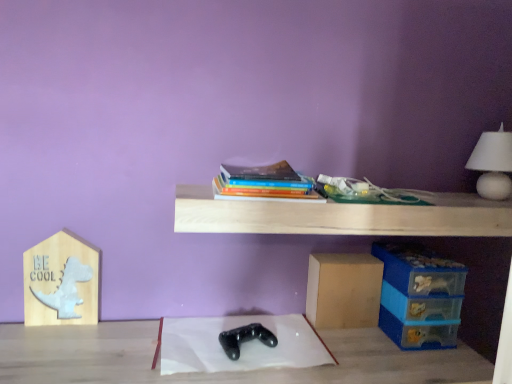
Where is `empty space that is ontop of white paper at center (from a real-world perspective)`? empty space that is ontop of white paper at center (from a real-world perspective) is located at coordinates (243, 341).